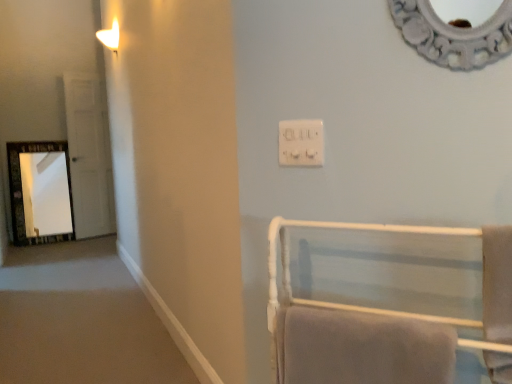
Question: Is white soft towel at lower right, which is the second bath towel in right-to-left order, bigger or smaller than white towel rack at lower right?

Choices:
 (A) small
 (B) big

Answer: (A)

Question: Based on their positions, is white soft towel at lower right, positioned as the first bath towel in left-to-right order, located to the left or right of white towel rack at lower right?

Choices:
 (A) right
 (B) left

Answer: (B)

Question: Estimate the real-world distances between objects in this image. Which object is closer to the white soft towel at right, arranged as the second bath towel when viewed from the left?

Choices:
 (A) matte white sconce at upper left
 (B) white plastic electrical outlet at upper center
 (C) white glossy door at left
 (D) white towel rack at lower right
 (E) white soft towel at lower right, positioned as the first bath towel in left-to-right order

Answer: (D)

Question: Which object is the closest to the white towel rack at lower right?

Choices:
 (A) white plastic electrical outlet at upper center
 (B) matte white sconce at upper left
 (C) white glossy door at left
 (D) white soft towel at right, arranged as the second bath towel when viewed from the left
 (E) white soft towel at lower right, positioned as the first bath towel in left-to-right order

Answer: (E)